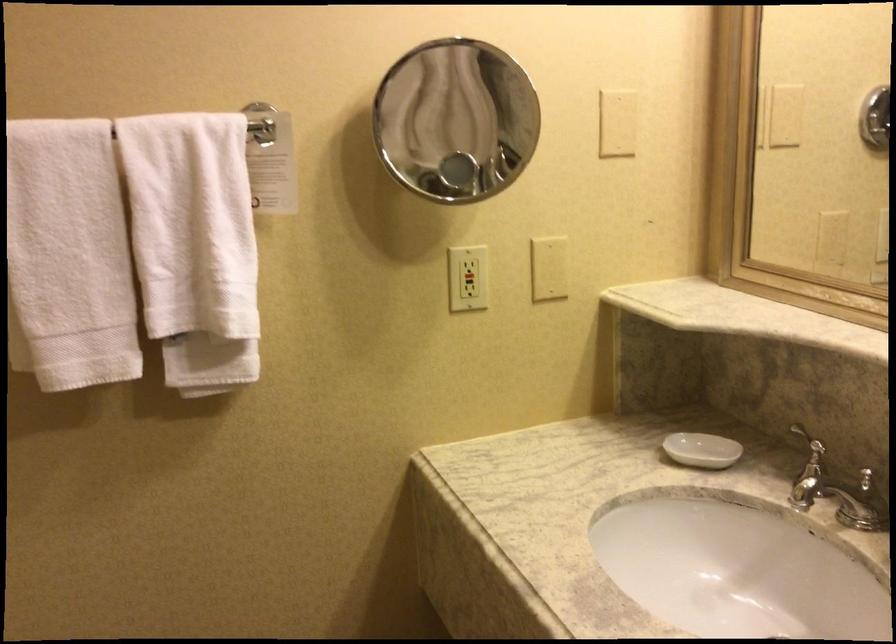
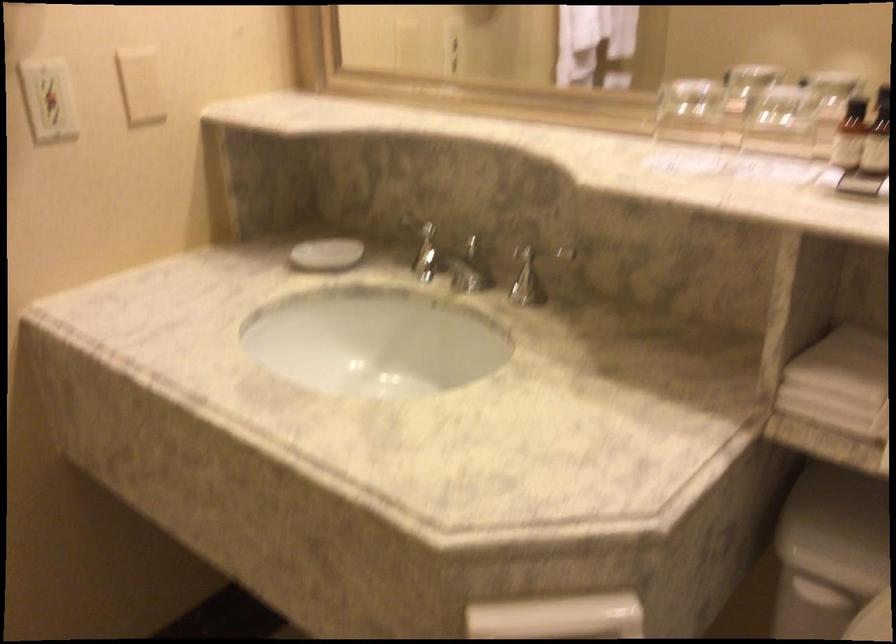
In the second image, find the point that corresponds to the point at 472,270 in the first image.

(47, 99)